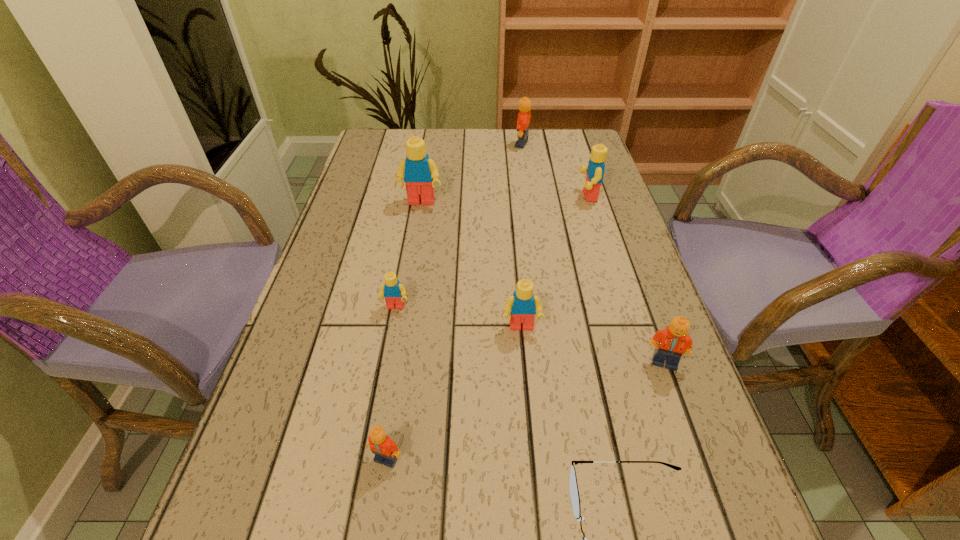
Where is `vacant space located 0.070m on the front-facing side of the sixth farthest object`? The image size is (960, 540). vacant space located 0.070m on the front-facing side of the sixth farthest object is located at coordinates (680, 407).

You are a GUI agent. You are given a task and a screenshot of the screen. Output one action in this format:
    pyautogui.click(x=<x>, y=<y>)
    Task: Click on the free location located 0.310m on the front-facing side of the fourth nearest object
    
    Given the screenshot: What is the action you would take?
    click(x=537, y=506)

Where is `free space located 0.060m on the front-facing side of the nearest orange Lego`? free space located 0.060m on the front-facing side of the nearest orange Lego is located at coordinates 378,511.

This screenshot has height=540, width=960. Identify the location of free space located on the front-facing side of the smallest yellow Lego. (383, 376).

The width and height of the screenshot is (960, 540). What are the coordinates of `object that is at the far edge` in the screenshot? It's located at (523, 123).

The height and width of the screenshot is (540, 960). In order to click on object located in the left edge section of the desktop in this screenshot , I will do `click(418, 171)`.

What are the coordinates of `free space at the far edge` in the screenshot? It's located at (536, 161).

The height and width of the screenshot is (540, 960). In the image, there is a desktop. Identify the location of vacant area at the left edge. (339, 245).

Where is `blank space at the right edge of the desktop`? blank space at the right edge of the desktop is located at coordinates (638, 353).

Locate an element on the screen. The height and width of the screenshot is (540, 960). vacant space at the far left corner of the desktop is located at coordinates (382, 138).